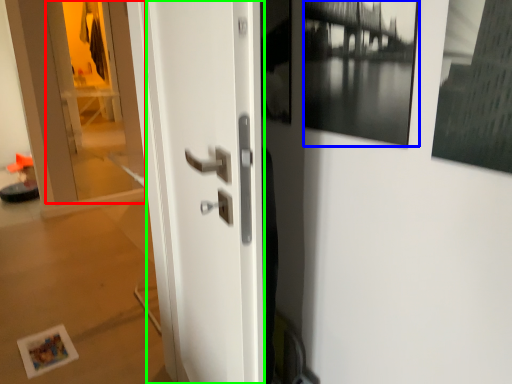
Question: Based on their relative distances, which object is nearer to glass door (highlighted by a red box)? Choose from picture frame (highlighted by a blue box) and door (highlighted by a green box).

Choices:
 (A) picture frame
 (B) door

Answer: (B)